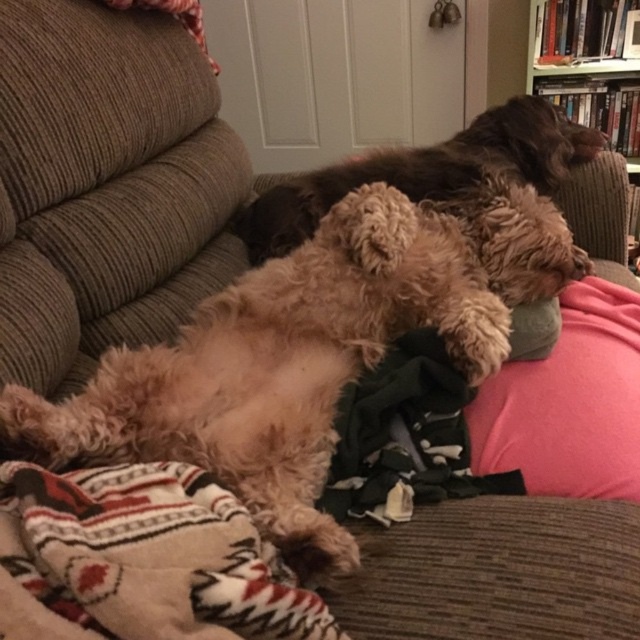
You are a dog owner who wants to place a new toy between the knitted wool blanket at lower left and the fuzzy brown dog at center. Based on their positions, where should you place the toy so it is between them?

The knitted wool blanket at lower left is in front of the fuzzy brown dog at center, so place the toy between them by positioning it in front of the fuzzy brown dog at center but behind the knitted wool blanket at lower left.

You are a photographer setting up a shot of the two dogs on the couch. You want to focus on the dog that is closer to the camera. Which point should you use to adjust your focus? Please choose between point (605, 428) and point (566, 104).

Point (605, 428) is closer to the camera than point (566, 104), so you should use point (605, 428) to focus on the dog that is closer to the camera.